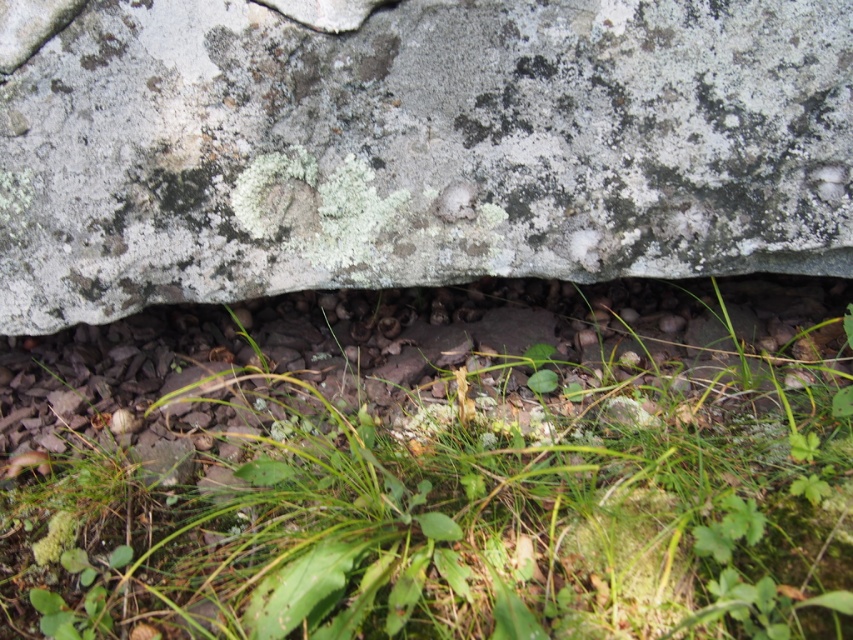
Question: Is green leafy grass at center closer to camera compared to gray/rough rock at center?

Choices:
 (A) no
 (B) yes

Answer: (B)

Question: Among these points, which one is nearest to the camera?

Choices:
 (A) (558, 244)
 (B) (572, 444)

Answer: (B)

Question: Can you confirm if green leafy grass at center is bigger than gray/rough rock at center?

Choices:
 (A) yes
 (B) no

Answer: (A)

Question: Can you confirm if green leafy grass at center is positioned to the right of gray/rough rock at center?

Choices:
 (A) yes
 (B) no

Answer: (A)